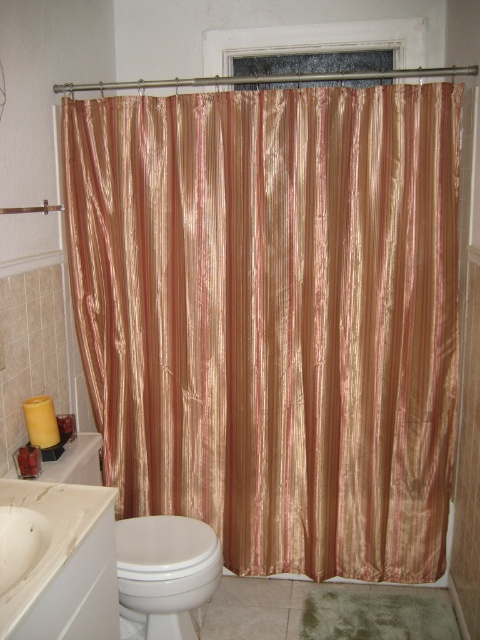
Who is higher up, shiny gold curtain at center or white glossy sink at lower left?

shiny gold curtain at center is higher up.

Which is in front, point (295, 275) or point (43, 573)?

Positioned in front is point (43, 573).

Locate an element on the screen. shiny gold curtain at center is located at coordinates coord(274,316).

Which is in front, point (448, 490) or point (163, 556)?

Positioned in front is point (163, 556).

Between shiny gold curtain at center and white glossy toilet bowl at lower left, which one is positioned lower?

white glossy toilet bowl at lower left is lower down.

Between point (187, 264) and point (154, 557), which one is positioned in front?

Positioned in front is point (154, 557).

Where is `shiny gold curtain at center`? The image size is (480, 640). shiny gold curtain at center is located at coordinates (274, 316).

Does white glossy sink at lower left lie behind white glossy toilet bowl at lower left?

No, white glossy sink at lower left is in front of white glossy toilet bowl at lower left.

Identify the location of white glossy sink at lower left. This screenshot has height=640, width=480. (57, 561).

Is point (52, 561) more distant than point (203, 596)?

No, it is not.

You are a GUI agent. You are given a task and a screenshot of the screen. Output one action in this format:
    pyautogui.click(x=<x>, y=<y>)
    Task: Click on the white glossy sink at lower left
    
    Given the screenshot: What is the action you would take?
    pyautogui.click(x=57, y=561)